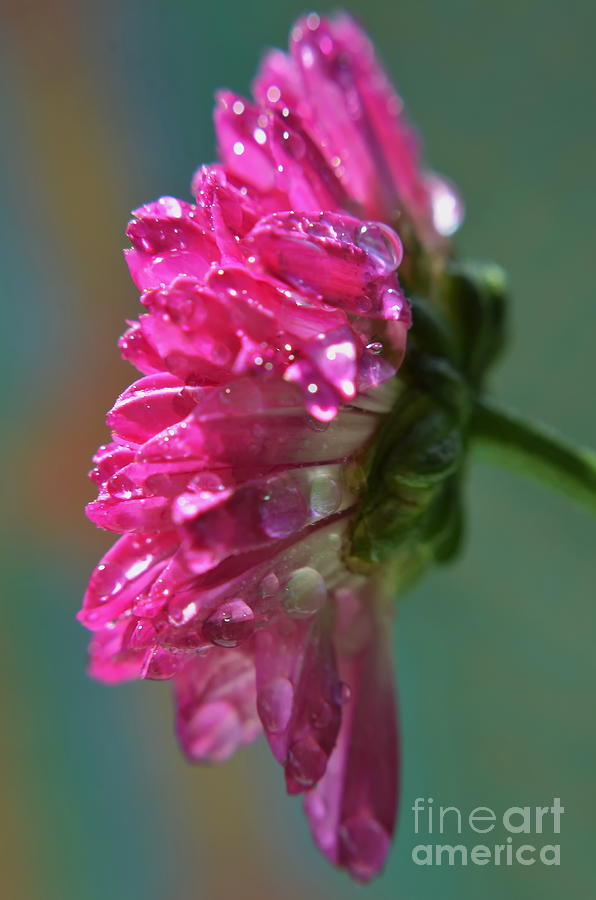
The height and width of the screenshot is (900, 596). What are the coordinates of `art` in the screenshot? It's located at (532, 814).